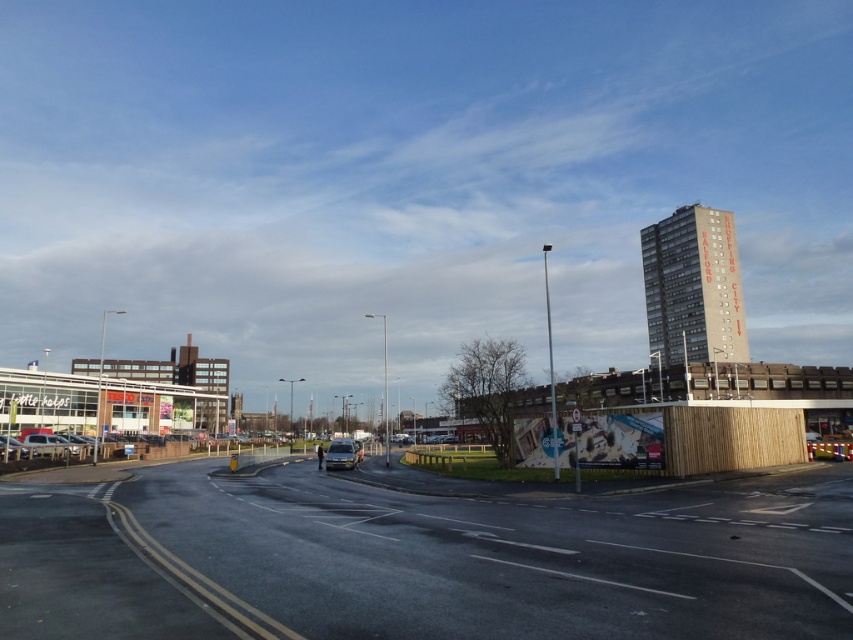
Question: Can you confirm if concrete building at right is positioned above matte silver car at lower left?

Choices:
 (A) no
 (B) yes

Answer: (B)

Question: Which point is farther to the camera?

Choices:
 (A) concrete building at right
 (B) silver metallic van at center

Answer: (A)

Question: Does concrete building at right appear under matte silver car at lower left?

Choices:
 (A) no
 (B) yes

Answer: (A)

Question: Which of the following is the closest to the observer?

Choices:
 (A) concrete building at right
 (B) matte silver car at lower left
 (C) metallic silver car at lower left

Answer: (C)

Question: Is concrete building at right bigger than silver metallic van at center?

Choices:
 (A) no
 (B) yes

Answer: (B)

Question: Which of the following is the closest to the observer?

Choices:
 (A) matte silver car at lower left
 (B) metallic silver car at lower left

Answer: (B)